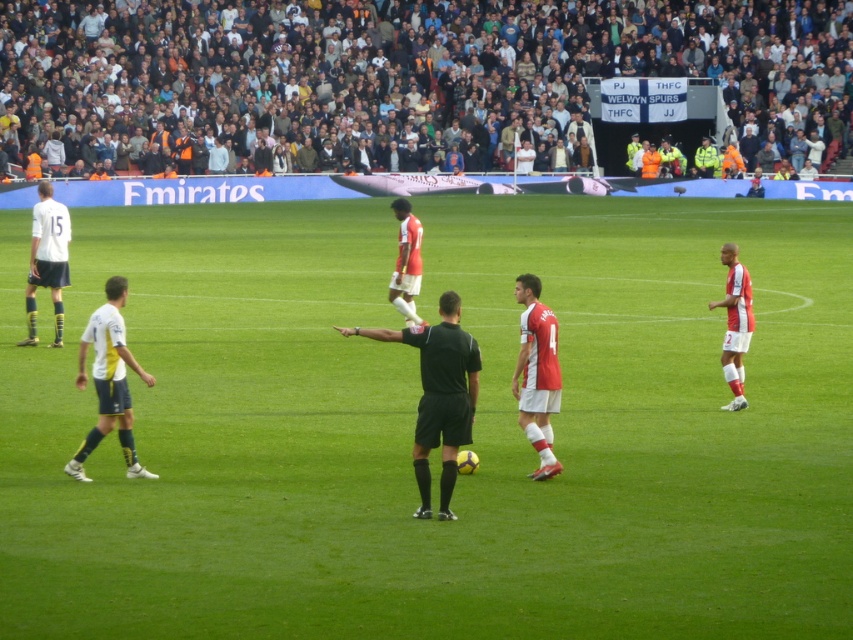
You are a soccer player on the field and you see the white matte shorts at left and the white jersey at right. Which direction should you move to get closer to both objects simultaneously?

Move towards the center between the white matte shorts at left and the white jersey at right since they are positioned to the left and right respectively.

You are a photographer standing at the edge of the soccer field. You want to take a photo that includes both the green grass football field at center and the white jersey at right. Which object should you focus on first to ensure both are in the frame?

The green grass football field at center has a larger size compared to white jersey at right, so you should focus on the larger field first to ensure both fit in the frame.

You are a soccer player positioned at point (451, 252) and need to pass the ball to your teammate at point (740, 365). Will your pass go over the field boundary line?

Point (451, 252) is behind point (740, 365), so the pass will go towards the teammate without crossing the field boundary line.